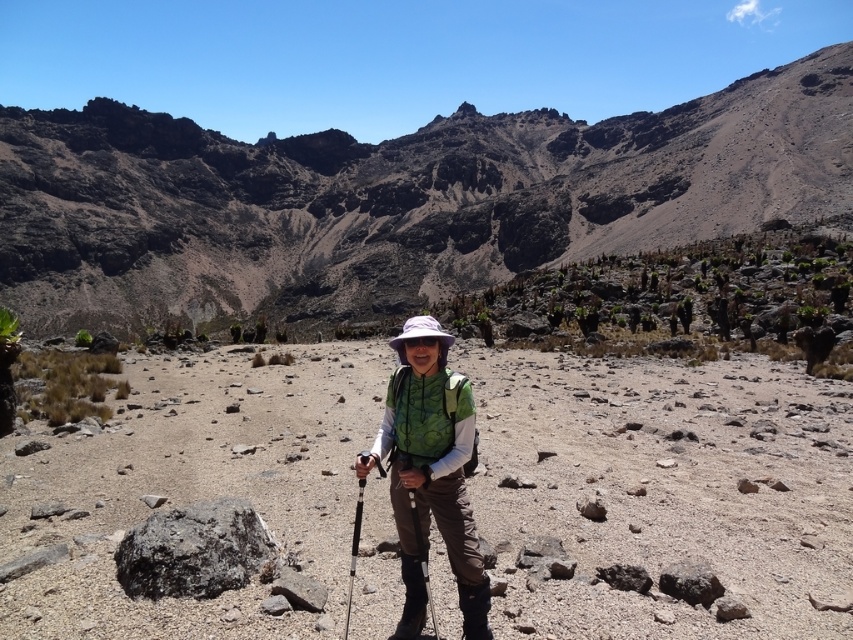
Can you confirm if brown rocky desert at center is smaller than dull gray rock at center?

Yes.

Between brown rocky desert at center and dull gray rock at center, which one is positioned higher?

dull gray rock at center is above.

Locate an element on the screen. This screenshot has width=853, height=640. brown rocky desert at center is located at coordinates (663, 490).

Consider the image. How distant is green fabric vest at center from matte black ski pole at center?

green fabric vest at center and matte black ski pole at center are 4.16 meters apart.

In the scene shown: Does green fabric vest at center have a larger size compared to matte black ski pole at center?

Correct, green fabric vest at center is larger in size than matte black ski pole at center.

The image size is (853, 640). Describe the element at coordinates (430, 472) in the screenshot. I see `green fabric vest at center` at that location.

Where is `green fabric vest at center`? green fabric vest at center is located at coordinates click(430, 472).

Who is lower down, dull gray rock at center or green fabric vest at center?

green fabric vest at center is below.

Looking at this image, is dull gray rock at center behind green fabric vest at center?

Yes, dull gray rock at center is behind green fabric vest at center.

Describe the element at coordinates (395, 198) in the screenshot. I see `dull gray rock at center` at that location.

Find the location of `dull gray rock at center`. dull gray rock at center is located at coordinates (395, 198).